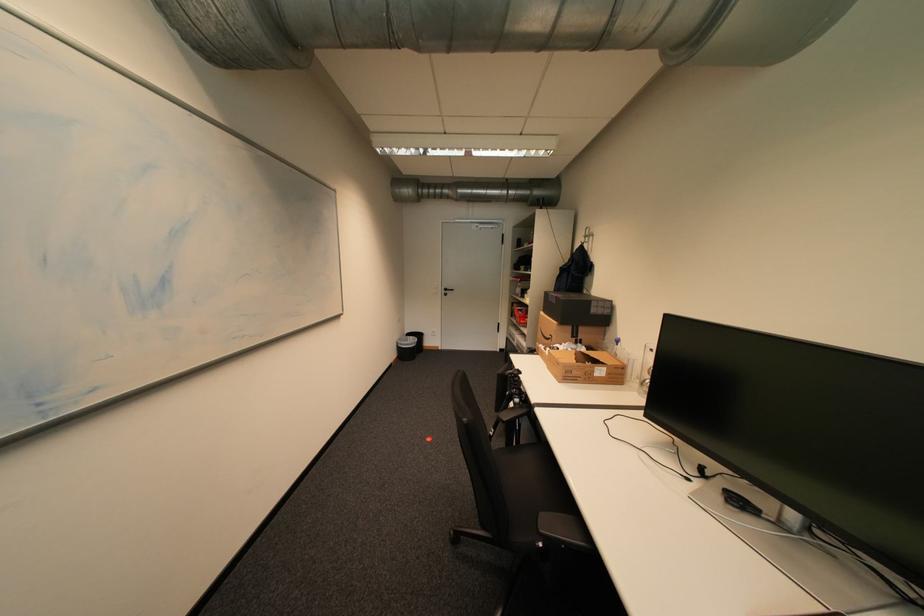
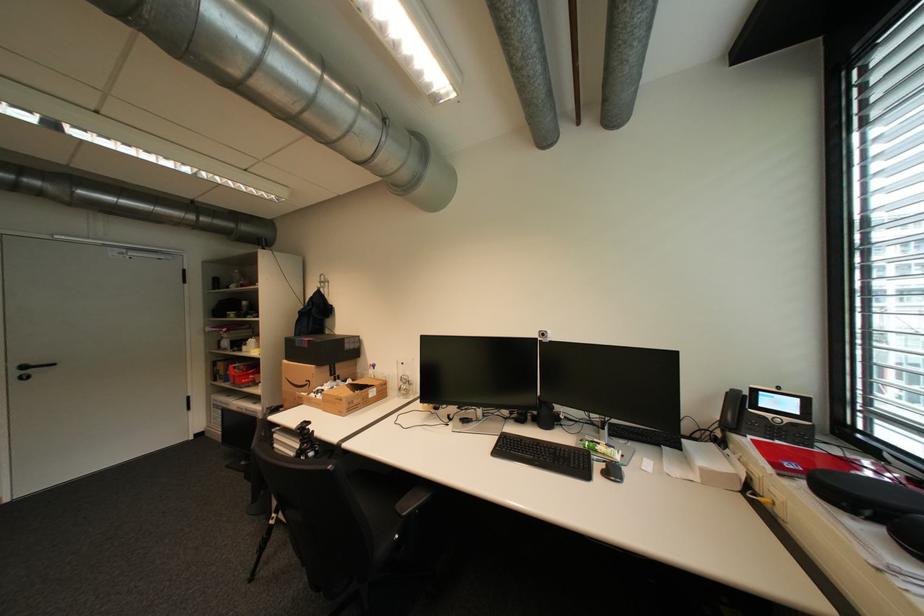
In the second image, find the point that corresponds to (x=569, y=268) in the first image.

(308, 312)